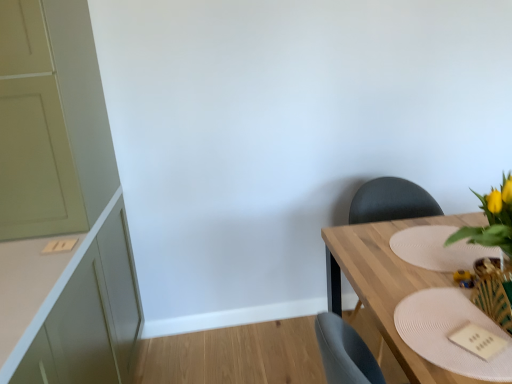
Question: Should I look upward or downward to see matte black chair at right?

Choices:
 (A) down
 (B) up

Answer: (A)

Question: From a real-world perspective, is yellow artificial flowers at right over wooden textured vase at lower right?

Choices:
 (A) no
 (B) yes

Answer: (B)

Question: Is yellow artificial flowers at right shorter than wooden textured vase at lower right?

Choices:
 (A) yes
 (B) no

Answer: (B)

Question: From a real-world perspective, is yellow artificial flowers at right physically below wooden textured vase at lower right?

Choices:
 (A) yes
 (B) no

Answer: (B)

Question: Is yellow artificial flowers at right at the right side of wooden textured vase at lower right?

Choices:
 (A) no
 (B) yes

Answer: (B)

Question: Does yellow artificial flowers at right have a smaller size compared to wooden textured vase at lower right?

Choices:
 (A) no
 (B) yes

Answer: (A)

Question: From the image's perspective, is yellow artificial flowers at right over wooden textured vase at lower right?

Choices:
 (A) no
 (B) yes

Answer: (B)

Question: Is wooden table at right to the left of white textured placemat at right, positioned as the 2th plate in front-to-back order, from the viewer's perspective?

Choices:
 (A) no
 (B) yes

Answer: (A)

Question: Is the position of wooden table at right more distant than that of white textured placemat at right, the 1th plate viewed from the back?

Choices:
 (A) yes
 (B) no

Answer: (B)

Question: From a real-world perspective, is wooden table at right located higher than white textured placemat at right, positioned as the 2th plate in front-to-back order?

Choices:
 (A) yes
 (B) no

Answer: (B)

Question: Would you say wooden table at right is outside white textured placemat at right, placed as the 2th plate when sorted from bottom to top?

Choices:
 (A) yes
 (B) no

Answer: (A)

Question: Is wooden table at right thinner than white textured placemat at right, positioned as the 2th plate in front-to-back order?

Choices:
 (A) no
 (B) yes

Answer: (A)

Question: Considering the relative sizes of wooden table at right and white textured placemat at right, the 1th plate viewed from the back, in the image provided, is wooden table at right shorter than white textured placemat at right, the 1th plate viewed from the back,?

Choices:
 (A) no
 (B) yes

Answer: (A)

Question: Can you see matte black chair at right touching white textured placemat at lower right, arranged as the first plate when ordered from the bottom?

Choices:
 (A) no
 (B) yes

Answer: (A)